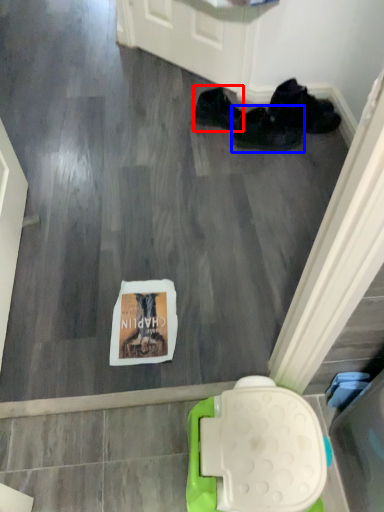
Question: Which object is further to the camera taking this photo, footwear (highlighted by a red box) or footwear (highlighted by a blue box)?

Choices:
 (A) footwear
 (B) footwear

Answer: (A)